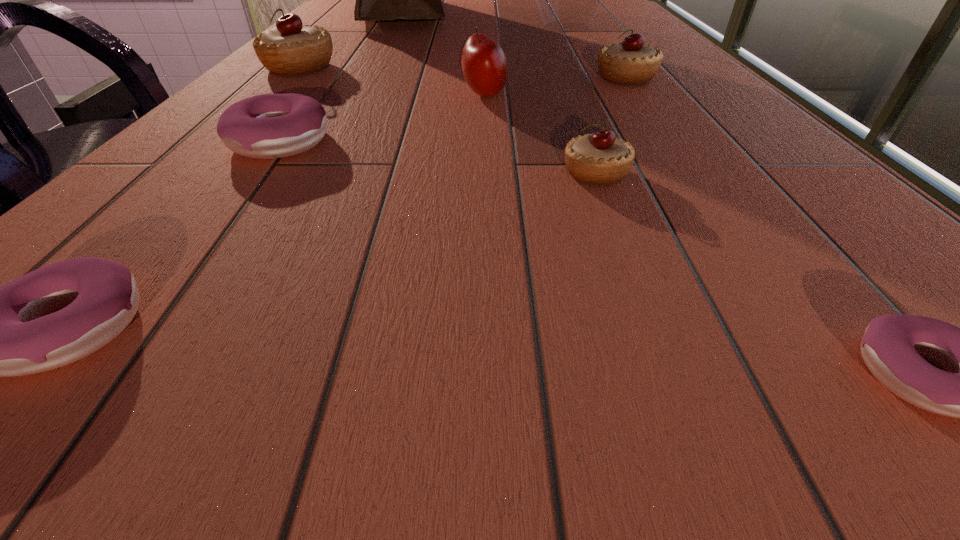
The height and width of the screenshot is (540, 960). What are the coordinates of `lampshade at the far edge` in the screenshot? It's located at (568, 0).

What are the coordinates of `grocery bag that is at the left edge` in the screenshot? It's located at (376, 0).

This screenshot has height=540, width=960. Find the location of `lampshade at the right edge`. lampshade at the right edge is located at coordinates (568, 0).

The width and height of the screenshot is (960, 540). What are the coordinates of `pastry situated at the right edge` in the screenshot? It's located at (630, 62).

This screenshot has height=540, width=960. In order to click on object that is at the far left corner in this screenshot , I will do `click(376, 0)`.

The image size is (960, 540). I want to click on object situated at the far right corner, so click(568, 0).

You are a GUI agent. You are given a task and a screenshot of the screen. Output one action in this format:
    pyautogui.click(x=<x>, y=<y>)
    Task: Click on the vacant space at the far edge of the desktop
    The image size is (960, 540).
    Given the screenshot: What is the action you would take?
    pyautogui.click(x=493, y=6)

Where is `vacant space at the near edge`? vacant space at the near edge is located at coordinates (420, 424).

Where is `vacant position at the left edge of the desktop`? The height and width of the screenshot is (540, 960). vacant position at the left edge of the desktop is located at coordinates (318, 25).

The height and width of the screenshot is (540, 960). Identify the location of vacant space at the right edge. (693, 88).